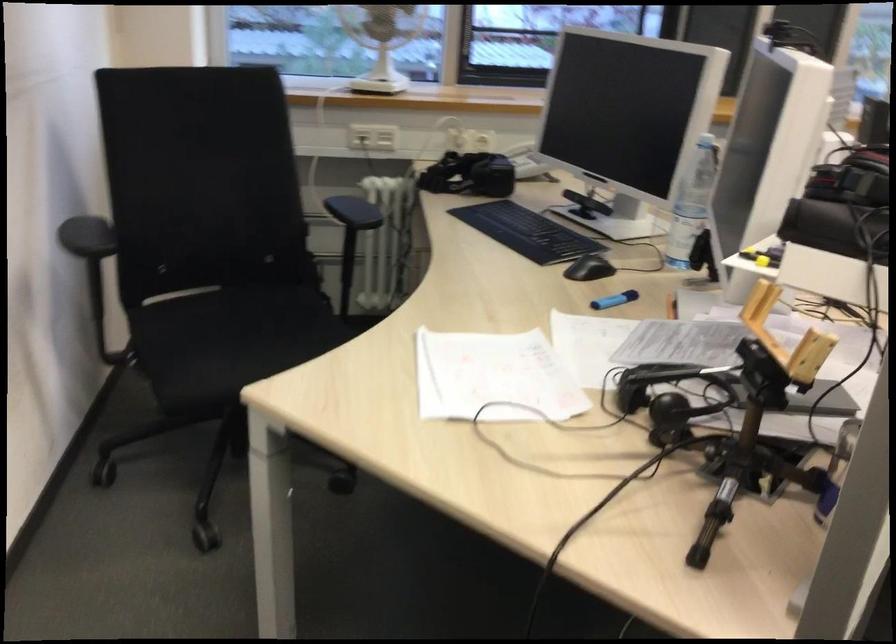
Find where to wear the black headset. Please return your answer as a coordinate pair (x, y).

(672, 389)